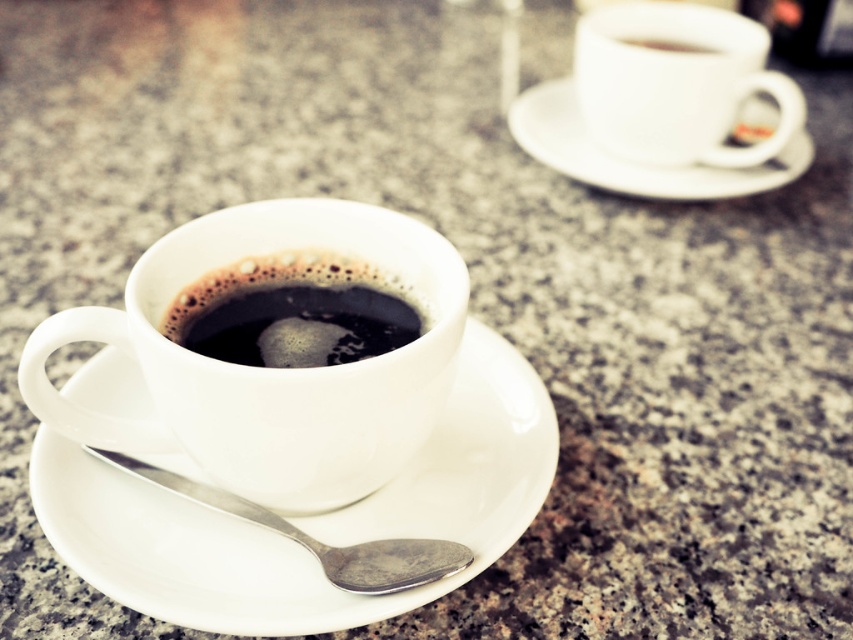
Between white glossy saucer at lower left and white ceramic saucer at upper right, which one has less height?

With less height is white glossy saucer at lower left.

Identify the location of white glossy saucer at lower left. The width and height of the screenshot is (853, 640). (309, 515).

This screenshot has height=640, width=853. I want to click on white glossy saucer at lower left, so click(x=309, y=515).

Can you confirm if white glossy saucer at lower left is bigger than silver metallic spoon at lower center?

Correct, white glossy saucer at lower left is larger in size than silver metallic spoon at lower center.

Which is more to the left, white glossy saucer at lower left or silver metallic spoon at lower center?

From the viewer's perspective, silver metallic spoon at lower center appears more on the left side.

The height and width of the screenshot is (640, 853). Identify the location of white glossy saucer at lower left. (309, 515).

Who is more forward, (532, 458) or (274, 289)?

Positioned in front is point (532, 458).

Can you confirm if white glossy saucer at lower left is positioned above black glossy coffee at center?

No, white glossy saucer at lower left is not above black glossy coffee at center.

Does point (103, 362) come closer to viewer compared to point (318, 280)?

No, (103, 362) is behind (318, 280).

Locate an element on the screen. This screenshot has height=640, width=853. white glossy saucer at lower left is located at coordinates (309, 515).